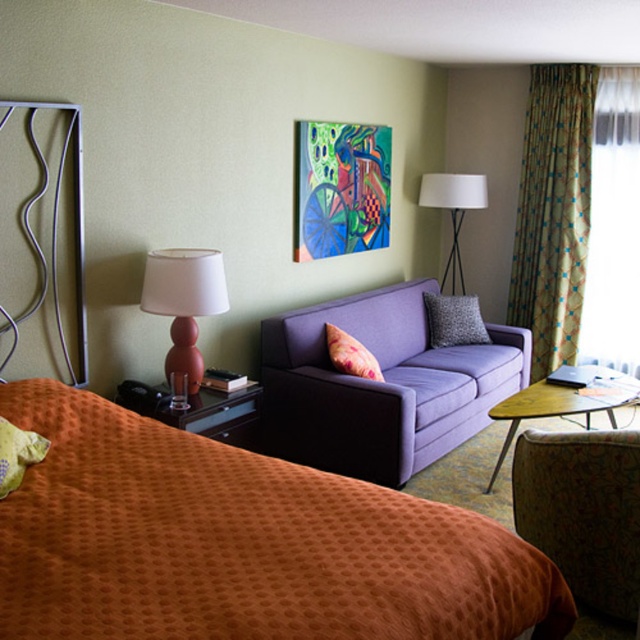
Question: Does matte orange side table at lower left appear on the right side of gray textured pillow at center?

Choices:
 (A) yes
 (B) no

Answer: (B)

Question: Among these objects, which one is nearest to the camera?

Choices:
 (A) gray textured pillow at center
 (B) translucent fabric curtain at right
 (C) green textured pillow at lower left
 (D) purple fabric couch at center

Answer: (C)

Question: Which point is farther to the camera?

Choices:
 (A) 604,314
 (B) 349,365
 (C) 531,275

Answer: (C)

Question: Does matte pink lamp at left have a greater width compared to woodenwoodentable at right?

Choices:
 (A) yes
 (B) no

Answer: (B)

Question: Among these objects, which one is nearest to the camera?

Choices:
 (A) green patterned curtain at right
 (B) green textured pillow at lower left
 (C) floral fabric pillow at center

Answer: (B)

Question: Does translucent fabric curtain at right have a smaller size compared to woodenwoodentable at right?

Choices:
 (A) yes
 (B) no

Answer: (A)